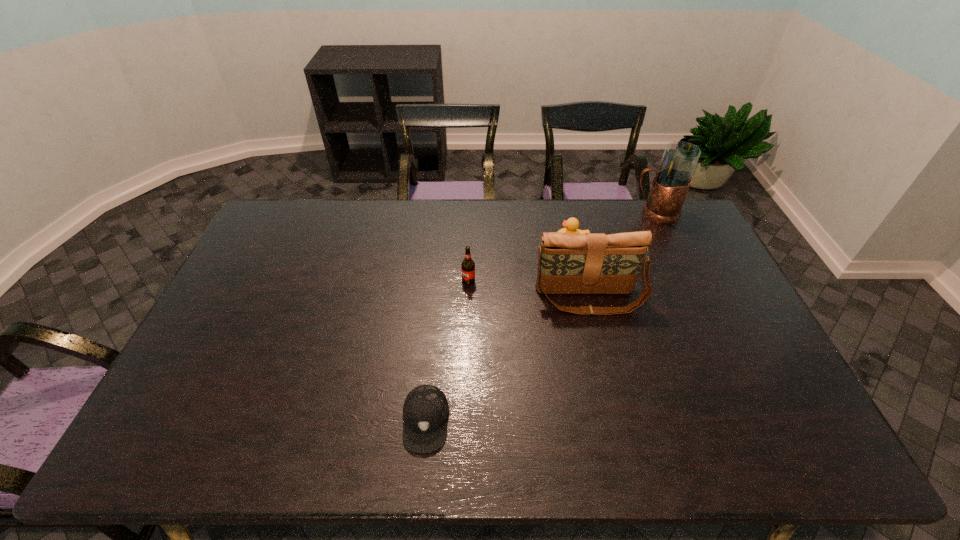
You are a GUI agent. You are given a task and a screenshot of the screen. Output one action in this format:
    pyautogui.click(x=<x>, y=<y>)
    Task: Click on the blank space located with the handle on the side of the farthest object
    The image size is (960, 540).
    Given the screenshot: What is the action you would take?
    pyautogui.click(x=547, y=212)

I want to click on free point located with the handle on the side of the farthest object, so click(607, 212).

The height and width of the screenshot is (540, 960). I want to click on vacant space located on the front-facing side of the shoulder bag, so point(597,338).

Where is `free space located on the right of the root beer`? The image size is (960, 540). free space located on the right of the root beer is located at coordinates (564, 280).

You are a GUI agent. You are given a task and a screenshot of the screen. Output one action in this format:
    pyautogui.click(x=<x>, y=<y>)
    Task: Click on the vacant space located on the face of the fourth nearest object
    
    Given the screenshot: What is the action you would take?
    pyautogui.click(x=450, y=243)

Identify the location of vacant space located 0.120m on the face of the fourth nearest object. The width and height of the screenshot is (960, 540). (521, 243).

The width and height of the screenshot is (960, 540). Find the location of `vacant space located 0.320m on the face of the fourth nearest object`. vacant space located 0.320m on the face of the fourth nearest object is located at coordinates (465, 243).

Locate an element on the screen. This screenshot has width=960, height=540. pitcher that is at the far edge is located at coordinates (671, 183).

Locate an element on the screen. duck that is at the far edge is located at coordinates (572, 224).

The height and width of the screenshot is (540, 960). I want to click on object located at the near edge, so click(425, 411).